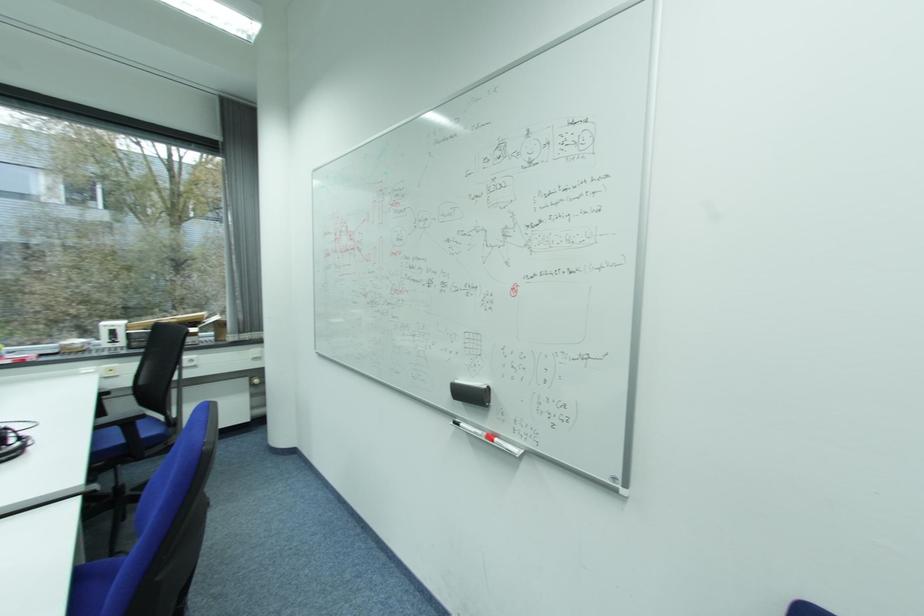
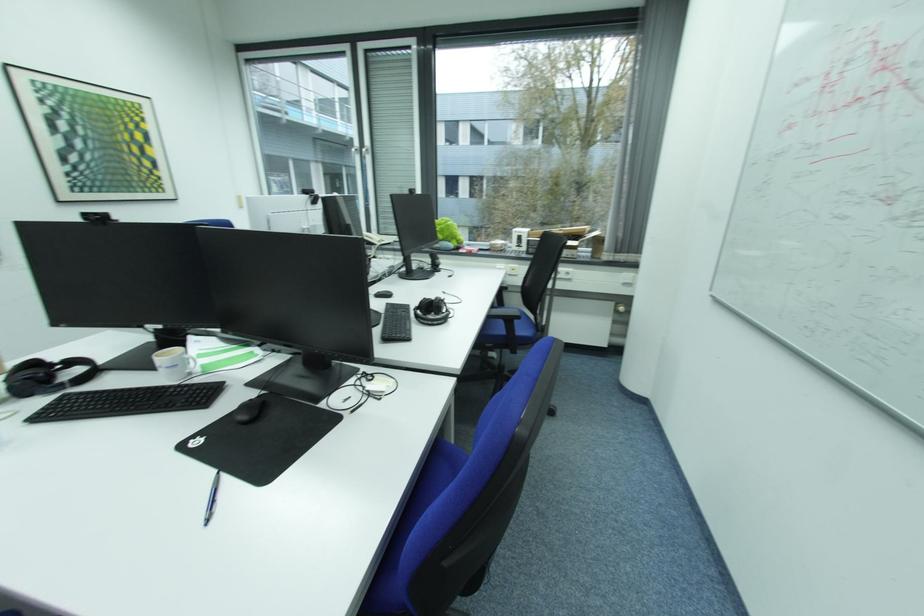
How did the camera likely rotate?

The camera rotated toward left-down.